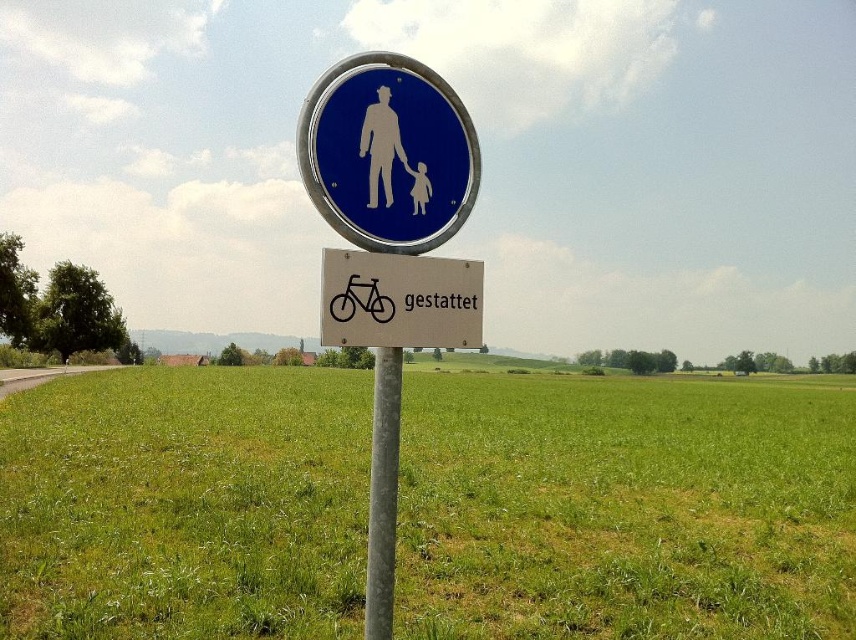
You are a cyclist approaching the signpost in the rural area. You see the green grass at center and the white plastic bicycle at center. Which object is closer to the ground?

The green grass at center is located below the white plastic bicycle at center, so the green grass at center is closer to the ground.

You are a hiker trying to determine the best path to avoid getting your shoes dirty. You notice the green grass at center and the blue glossy sign at upper center. Which area is higher and thus less likely to be muddy after rain?

The green grass at center is taller than the blue glossy sign at upper center, so the green grass at center is higher and less likely to be muddy after rain.